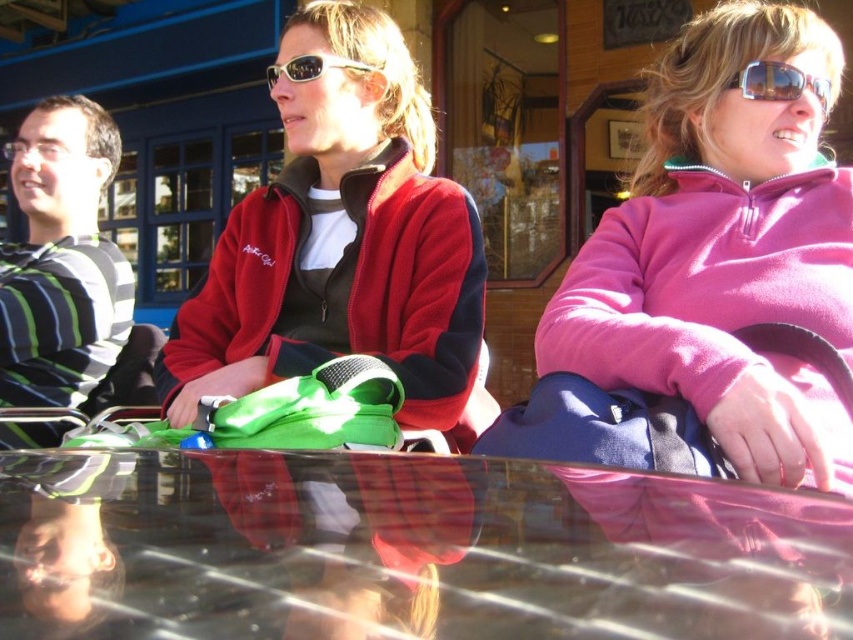
Is matte red fleece jacket at center above striped cotton shirt at left?

Indeed, matte red fleece jacket at center is positioned over striped cotton shirt at left.

Is the position of matte red fleece jacket at center more distant than that of striped cotton shirt at left?

That is False.

Which is in front, point (480, 264) or point (39, 177)?

Point (480, 264)

Locate an element on the screen. The height and width of the screenshot is (640, 853). matte red fleece jacket at center is located at coordinates (344, 244).

Can you confirm if pink fleece jacket at upper right is positioned above matte red fleece jacket at center?

No, pink fleece jacket at upper right is not above matte red fleece jacket at center.

Is point (828, 192) more distant than point (231, 307)?

No, it is in front of (231, 307).

Where is `pink fleece jacket at upper right`? This screenshot has height=640, width=853. pink fleece jacket at upper right is located at coordinates (724, 252).

Who is higher up, transparent glass table at center or sunglasses at upper right?

Positioned higher is sunglasses at upper right.

Is transparent glass table at center taller than sunglasses at upper right?

In fact, transparent glass table at center may be shorter than sunglasses at upper right.

Is point (143, 516) farther from camera compared to point (775, 80)?

No, (143, 516) is in front of (775, 80).

Identify the location of transparent glass table at center. This screenshot has height=640, width=853. (405, 550).